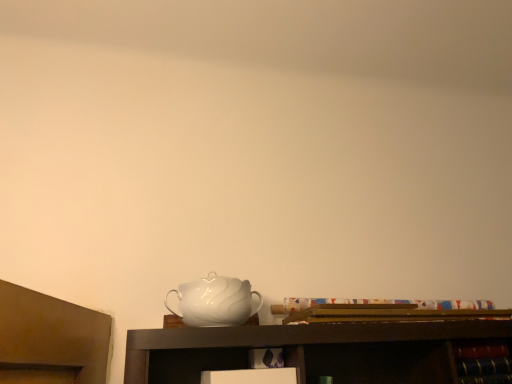
The height and width of the screenshot is (384, 512). What do you see at coordinates (483, 362) in the screenshot? I see `wooden cabinet at lower right` at bounding box center [483, 362].

Where is `wooden cabinet at lower right`? This screenshot has height=384, width=512. wooden cabinet at lower right is located at coordinates (483, 362).

What are the coordinates of `white glossy jug at center` in the screenshot? It's located at (215, 301).

Measure the distance between point (191,302) and camera.

The depth of point (191,302) is 3.79 feet.

Describe the element at coordinates (215, 301) in the screenshot. I see `white glossy jug at center` at that location.

What are the coordinates of `wooden cabinet at lower right` in the screenshot? It's located at pyautogui.click(x=483, y=362).

Considering the relative positions of wooden cabinet at lower right and white glossy jug at center in the image provided, is wooden cabinet at lower right to the left of white glossy jug at center from the viewer's perspective?

Incorrect, wooden cabinet at lower right is not on the left side of white glossy jug at center.

Which object is further away from the camera, wooden cabinet at lower right or white glossy jug at center?

wooden cabinet at lower right is more distant.

Is point (503, 376) closer or farther from the camera than point (222, 290)?

Point (503, 376) appears to be farther away from the viewer than point (222, 290).

From the image's perspective, is wooden cabinet at lower right positioned above or below white glossy jug at center?

From the image's perspective, wooden cabinet at lower right appears below white glossy jug at center.

From a real-world perspective, is wooden cabinet at lower right below white glossy jug at center?

Yes, from a real-world perspective, wooden cabinet at lower right is beneath white glossy jug at center.

Which object is thinner, wooden cabinet at lower right or white glossy jug at center?

wooden cabinet at lower right.

Considering the relative sizes of wooden cabinet at lower right and white glossy jug at center in the image provided, is wooden cabinet at lower right taller than white glossy jug at center?

Incorrect, the height of wooden cabinet at lower right is not larger of that of white glossy jug at center.

From the picture: Who is smaller, wooden cabinet at lower right or white glossy jug at center?

Smaller between the two is wooden cabinet at lower right.

Is wooden cabinet at lower right not within white glossy jug at center?

Yes.

Consider the image. Is wooden cabinet at lower right placed right next to white glossy jug at center?

No, wooden cabinet at lower right is not next to white glossy jug at center.

Could you tell me if wooden cabinet at lower right is facing white glossy jug at center?

No, wooden cabinet at lower right is not aimed at white glossy jug at center.

Can you tell me how much wooden cabinet at lower right and white glossy jug at center differ in facing direction?

The facing directions of wooden cabinet at lower right and white glossy jug at center are 3.97 degrees apart.

Locate an element on the screen. The height and width of the screenshot is (384, 512). jug in front of the wooden cabinet at lower right is located at coordinates (215, 301).

From the picture: Does white glossy jug at center appear on the left side of wooden cabinet at lower right?

Correct, you'll find white glossy jug at center to the left of wooden cabinet at lower right.

Which object is closer to the camera, white glossy jug at center or wooden cabinet at lower right?

white glossy jug at center.

Does point (210, 280) appear closer or farther from the camera than point (459, 375)?

Point (210, 280) appears to be closer to the viewer than point (459, 375).

From the image's perspective, is white glossy jug at center over wooden cabinet at lower right?

Yes, from the image's perspective, white glossy jug at center is over wooden cabinet at lower right.

From a real-world perspective, is white glossy jug at center positioned above or below wooden cabinet at lower right?

white glossy jug at center is situated higher than wooden cabinet at lower right in the real world.

In terms of width, does white glossy jug at center look wider or thinner when compared to wooden cabinet at lower right?

white glossy jug at center is wider than wooden cabinet at lower right.

Which of these two, white glossy jug at center or wooden cabinet at lower right, stands shorter?

With less height is wooden cabinet at lower right.

Does white glossy jug at center have a larger size compared to wooden cabinet at lower right?

Correct, white glossy jug at center is larger in size than wooden cabinet at lower right.

Choose the correct answer: Is white glossy jug at center inside wooden cabinet at lower right or outside it?

white glossy jug at center lies outside wooden cabinet at lower right.

From the picture: Are white glossy jug at center and wooden cabinet at lower right far apart?

white glossy jug at center is near wooden cabinet at lower right, not far away.

Is white glossy jug at center facing away from wooden cabinet at lower right?

No.

How many degrees apart are the facing directions of white glossy jug at center and wooden cabinet at lower right?

white glossy jug at center and wooden cabinet at lower right are facing 3.97 degrees away from each other.

The height and width of the screenshot is (384, 512). What are the coordinates of `cabinet located below the white glossy jug at center (from the image's perspective)` in the screenshot? It's located at (483, 362).

The image size is (512, 384). I want to click on jug on the left of the wooden cabinet at lower right, so click(215, 301).

The image size is (512, 384). In order to click on cabinet that appears below the white glossy jug at center (from the image's perspective) in this screenshot , I will do pos(483,362).